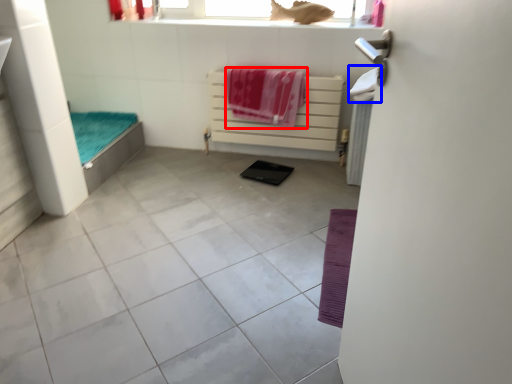
Question: Among these objects, which one is farthest to the camera, beach towel (highlighted by a red box) or beach towel (highlighted by a blue box)?

Choices:
 (A) beach towel
 (B) beach towel

Answer: (A)